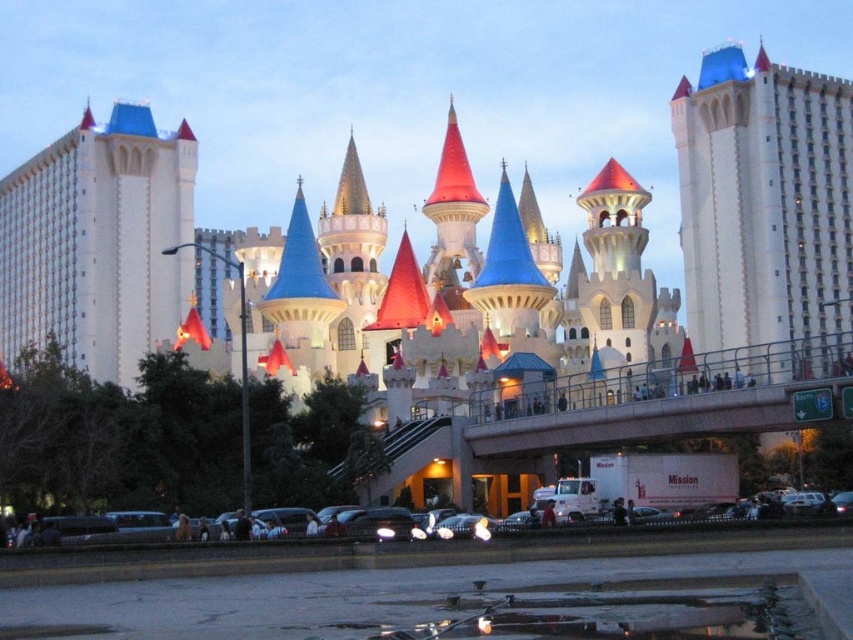
Can you confirm if white stone castle at right is bigger than shiny black car at lower center?

Yes, white stone castle at right is bigger than shiny black car at lower center.

Does white stone castle at right lie in front of shiny black car at lower center?

No, it is behind shiny black car at lower center.

Is point (685, 259) farther from viewer compared to point (94, 525)?

Yes.

Image resolution: width=853 pixels, height=640 pixels. Identify the location of white stone castle at right. (764, 205).

Can you confirm if white glossy hotel tower at left is positioned to the right of shiny black car at lower center?

No, white glossy hotel tower at left is not to the right of shiny black car at lower center.

Is white glossy hotel tower at left bigger than shiny black car at lower center?

Yes.

Describe the element at coordinates (97, 243) in the screenshot. I see `white glossy hotel tower at left` at that location.

Locate an element on the screen. Image resolution: width=853 pixels, height=640 pixels. white glossy hotel tower at left is located at coordinates (97, 243).

Looking at this image, does white stone castle at right have a larger size compared to white glossy hotel tower at left?

No.

Which is below, white stone castle at right or white glossy hotel tower at left?

white stone castle at right

I want to click on white stone castle at right, so click(x=764, y=205).